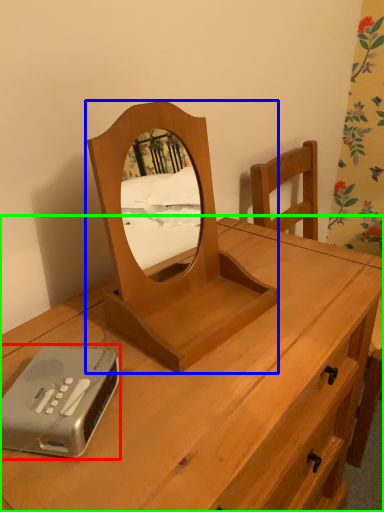
Question: Which is nearer to the gadget (highlighted by a red box)? mirror (highlighted by a blue box) or desk (highlighted by a green box).

Choices:
 (A) mirror
 (B) desk

Answer: (A)